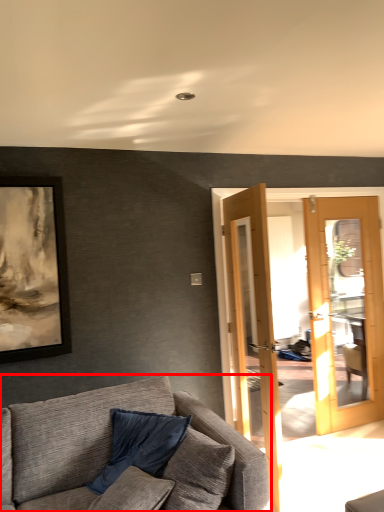
Question: Where is studio couch (annotated by the red box) located in relation to pillow in the image?

Choices:
 (A) left
 (B) right

Answer: (A)